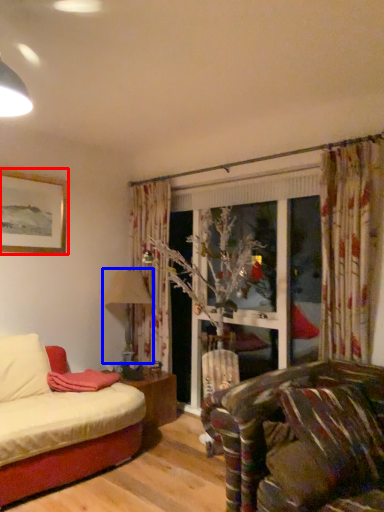
Question: Which object is closer to the camera taking this photo, picture frame (highlighted by a red box) or lamp (highlighted by a blue box)?

Choices:
 (A) picture frame
 (B) lamp

Answer: (A)